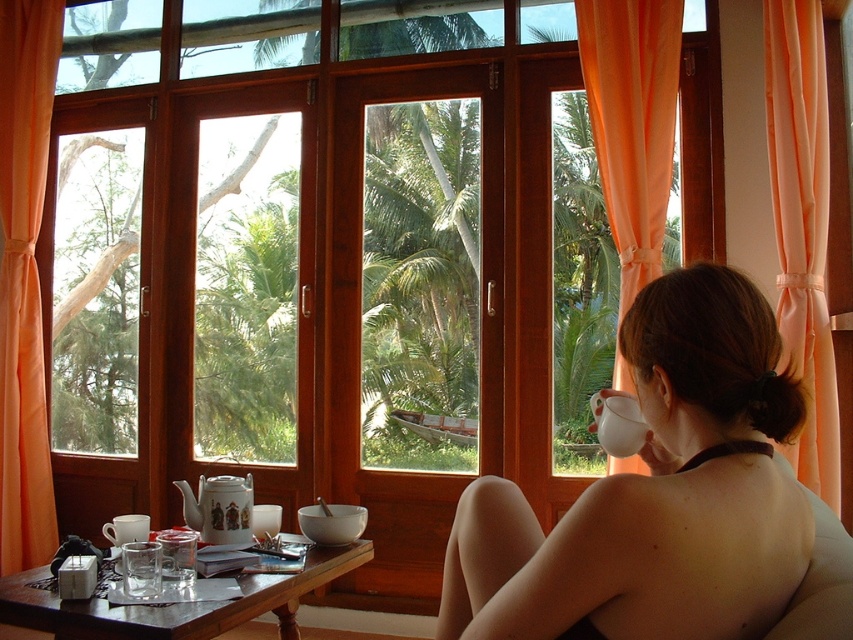
You are a guest in this room and want to place a decorative vase on the brown wooden table at lower center. However, the vase is quite tall. Considering the position of the peach satin curtain at right, is there enough vertical space between the table and the curtain to avoid the vase touching the curtain?

The peach satin curtain at right is located above the brown wooden table at lower center, so there is sufficient vertical space between them to place the vase without it touching the curtain.